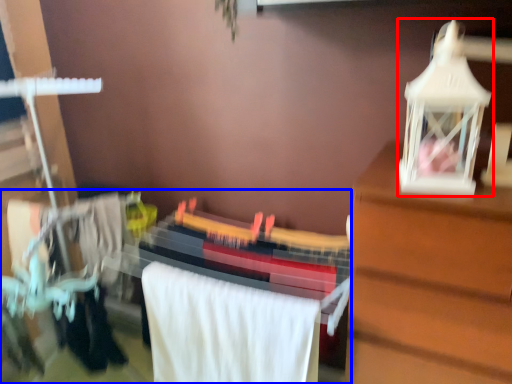
Question: Which object appears closest to the camera in this image, toy (highlighted by a red box) or closet (highlighted by a blue box)?

Choices:
 (A) toy
 (B) closet

Answer: (A)